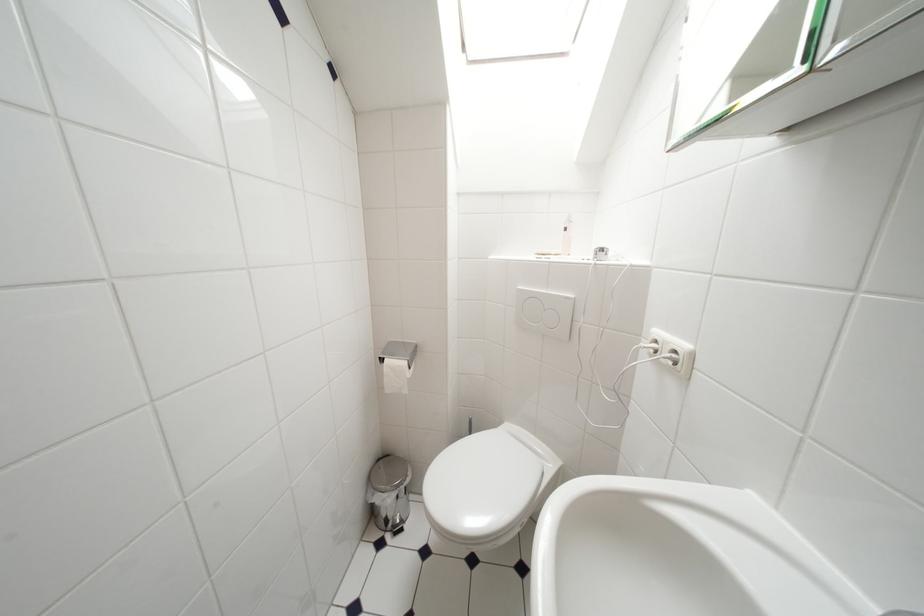
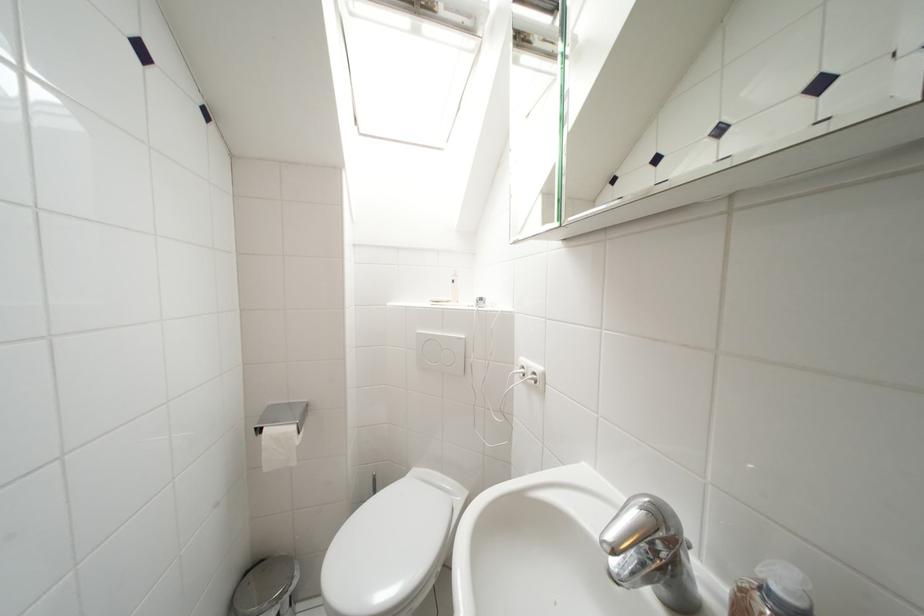
Where in the second image is the point corresponding to point 513,427 from the first image?

(420, 474)